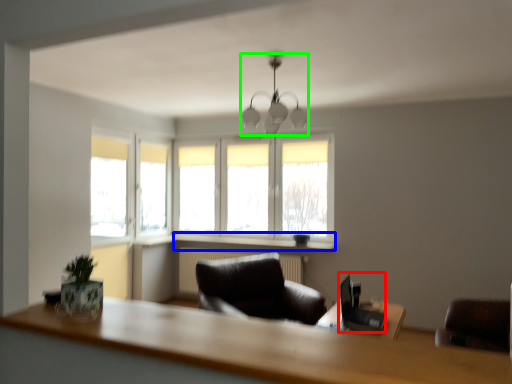
Question: Considering the real-world distances, which object is farthest from computer desk (highlighted by a red box)? window sill (highlighted by a blue box) or lamp (highlighted by a green box)?

Choices:
 (A) window sill
 (B) lamp

Answer: (B)